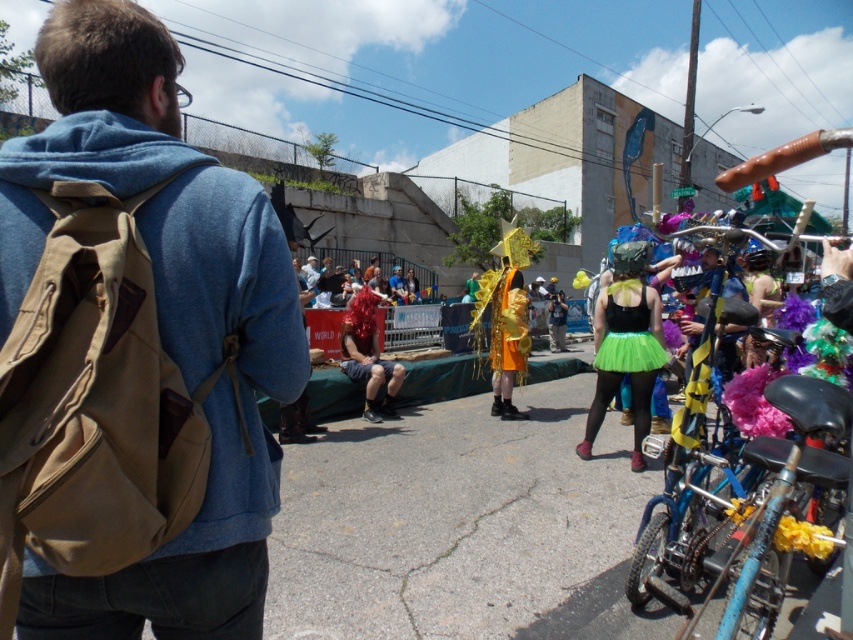
Question: Which of the following is the closest to the observer?

Choices:
 (A) blue metallic bicycle at lower right
 (B) blue metallic bicycle at right
 (C) green tulle skirt at center

Answer: (A)

Question: Which object is closer to the camera taking this photo?

Choices:
 (A) shiny gold costume at center
 (B) shiny red wig at center
 (C) blue metallic bicycle at lower right

Answer: (C)

Question: Can you confirm if shiny gold fabric at center is positioned below shiny gold costume at center?

Choices:
 (A) no
 (B) yes

Answer: (B)

Question: Can you confirm if blue metallic bicycle at right is bigger than green tulle skirt at center?

Choices:
 (A) yes
 (B) no

Answer: (A)

Question: Which point appears closest to the camera in this image?

Choices:
 (A) (392, 387)
 (B) (566, 305)
 (C) (850, 627)

Answer: (C)

Question: Can you confirm if gold shiny costume at center is thinner than shiny gold fabric at center?

Choices:
 (A) yes
 (B) no

Answer: (B)